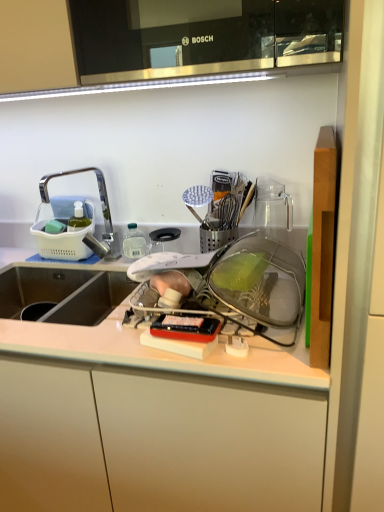
In order to face brushed metal faucet at left, should I rotate leftwards or rightwards?

To face it directly, rotate left by 13.555 degrees.

Find the location of `white plastic tray at center`. white plastic tray at center is located at coordinates (160, 352).

Looking at this image, based on their positions, is white matte cabinet at center located to the left or right of white plastic tray at center?

From the image, it's evident that white matte cabinet at center is to the left of white plastic tray at center.

Is white matte cabinet at center oriented towards white plastic tray at center?

No, white matte cabinet at center is not facing towards white plastic tray at center.

Which point is more distant from viewer, (102, 473) or (110, 354)?

Positioned behind is point (102, 473).

From a real-world perspective, between white matte cabinet at center and white plastic tray at center, who is vertically higher?

white plastic tray at center is physically above.

Considering the relative sizes of white matte cabinet at center and brushed metal faucet at left in the image provided, is white matte cabinet at center bigger than brushed metal faucet at left?

Indeed, white matte cabinet at center has a larger size compared to brushed metal faucet at left.

From a real-world perspective, which object rests below the other?

white matte cabinet at center, from a real-world perspective.

In the scene shown: Is brushed metal faucet at left at the back of white matte cabinet at center?

No, white matte cabinet at center's orientation is not away from brushed metal faucet at left.

Would you say white plastic tray at center is inside or outside brushed metal faucet at left?

white plastic tray at center exists outside the volume of brushed metal faucet at left.

Is white plastic tray at center facing away from brushed metal faucet at left?

white plastic tray at center does not have its back to brushed metal faucet at left.

Which is in front, point (22, 293) or point (99, 169)?

Point (99, 169)

Does white plastic tray at center have a greater width compared to brushed metal faucet at left?

Correct, the width of white plastic tray at center exceeds that of brushed metal faucet at left.

Does brushed metal faucet at left come behind white plastic tray at center?

Yes, brushed metal faucet at left is further from the viewer.

Can you tell me how much brushed metal faucet at left and white plastic tray at center differ in facing direction?

0.766 degrees separate the facing orientations of brushed metal faucet at left and white plastic tray at center.

Which object is wider, brushed metal faucet at left or white plastic tray at center?

With larger width is white plastic tray at center.

From a real-world perspective, which object rests below the other?

In real-world perspective, white plastic tray at center is lower.

How much distance is there between white plastic tray at center and white matte cabinet at center?

white plastic tray at center and white matte cabinet at center are 17.02 centimeters apart.

Which point is more distant from viewer, (261, 371) or (139, 443)?

The point (139, 443) is farther.

Who is smaller, white plastic tray at center or white matte cabinet at center?

With smaller size is white plastic tray at center.

From the image's perspective, would you say white plastic tray at center is positioned over white matte cabinet at center?

Yes, from the image's perspective, white plastic tray at center is above white matte cabinet at center.

Are brushed metal faucet at left and white matte cabinet at center located far from each other?

brushed metal faucet at left is near white matte cabinet at center, not far away.

Which object is closer to the camera taking this photo, brushed metal faucet at left or white matte cabinet at center?

white matte cabinet at center.

Considering the relative sizes of brushed metal faucet at left and white matte cabinet at center in the image provided, is brushed metal faucet at left smaller than white matte cabinet at center?

Indeed, brushed metal faucet at left has a smaller size compared to white matte cabinet at center.

Between brushed metal faucet at left and white matte cabinet at center, which one has more height?

With more height is white matte cabinet at center.

What are the coordinates of `cabinetry to the left of white plastic tray at center` in the screenshot? It's located at (155, 442).

The height and width of the screenshot is (512, 384). Identify the location of cabinetry that is below the brushed metal faucet at left (from the image's perspective). (155, 442).

Which object lies further to the anchor point white matte cabinet at center, brushed metal faucet at left or white plastic tray at center?

brushed metal faucet at left.

Looking at the image, which one is located closer to brushed metal faucet at left, white plastic tray at center or white matte cabinet at center?

white plastic tray at center lies closer to brushed metal faucet at left than the other object.

From the picture: Based on their spatial positions, is white matte cabinet at center or brushed metal faucet at left further from white plastic tray at center?

brushed metal faucet at left.

Based on their spatial positions, is white plastic tray at center or brushed metal faucet at left closer to white matte cabinet at center?

white plastic tray at center is positioned closer to the anchor white matte cabinet at center.

When comparing their distances from brushed metal faucet at left, does white matte cabinet at center or white plastic tray at center seem further?

The object further to brushed metal faucet at left is white matte cabinet at center.

Based on their spatial positions, is brushed metal faucet at left or white matte cabinet at center closer to white plastic tray at center?

white matte cabinet at center lies closer to white plastic tray at center than the other object.

Locate an element on the screen. This screenshot has height=512, width=384. countertop between brushed metal faucet at left and white matte cabinet at center from top to bottom is located at coordinates (160, 352).